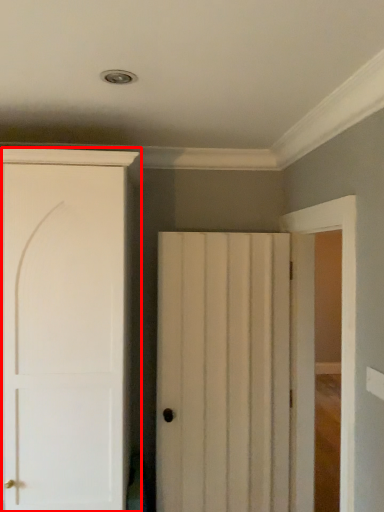
Question: In this image, where is door (annotated by the red box) located relative to door?

Choices:
 (A) left
 (B) right

Answer: (A)